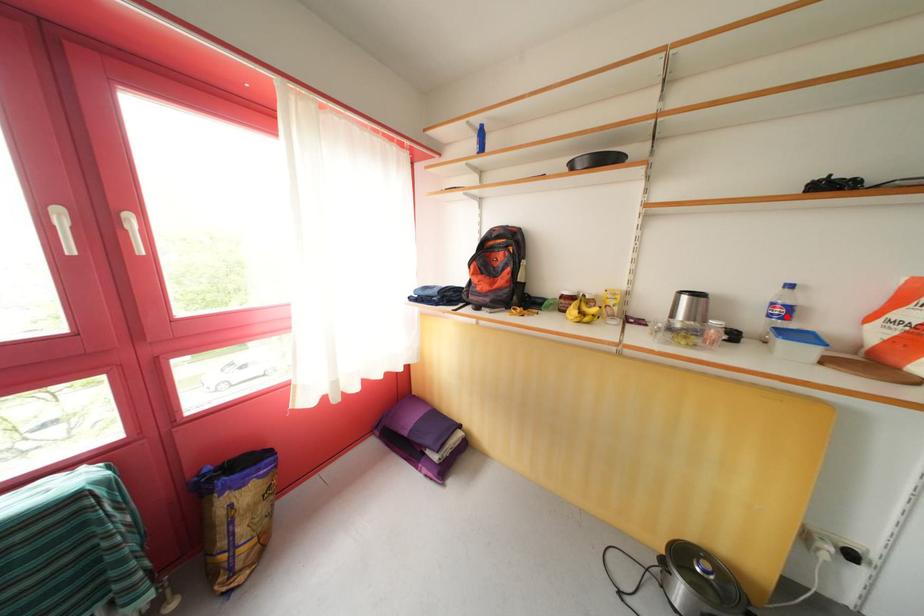
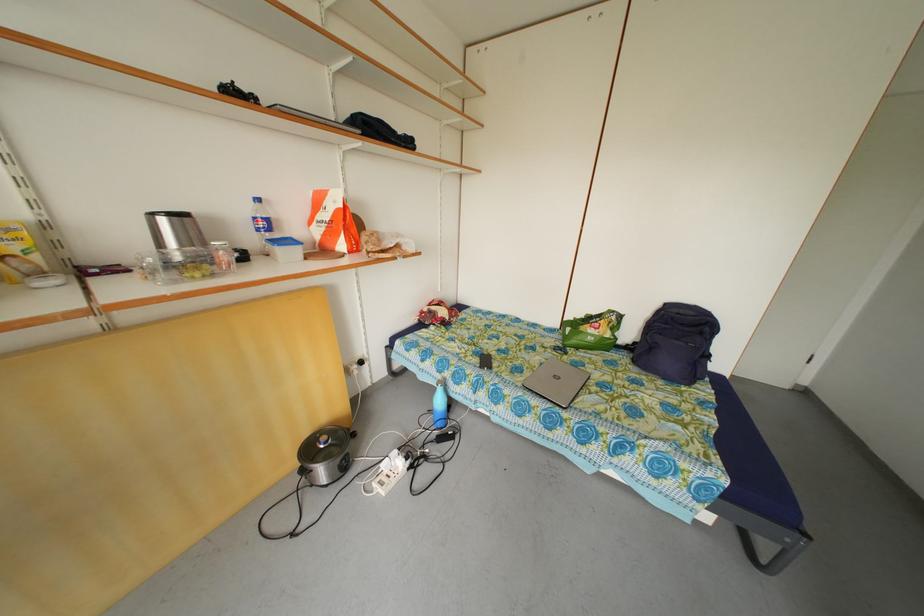
Question: I am providing you with two images of the same scene from different viewpoints. A red point is marked on the first image. At the location where the point appears in image 1, is it still visible in image 2?

Choices:
 (A) Yes
 (B) No

Answer: (A)